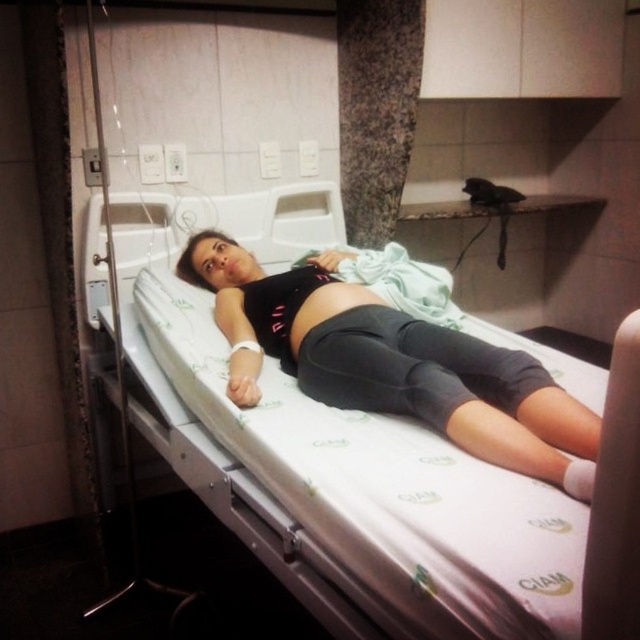
You are a nurse in the hospital room and need to locate two specific points for medical procedures. The first point is at coordinate point (387, 513) and the second is at point (189, 276). Which point is closer to you?

Point (387, 513) is closer to the viewer than point (189, 276).

You are a nurse checking the patient in the hospital room. You need to adjust the bed height to ensure the patient can safely sit up. Considering the current height of the white fabric hospital bed at center and the height of the black matte leggings at center, what should you do?

The white fabric hospital bed at center is taller than the black matte leggings at center. To allow the patient to sit up safely, adjust the bed height so that the mattress surface is at a comfortable level where the patient can easily place their feet on the floor while sitting, ensuring they can support themselves without straining.

In the scene shown: You are a healthcare worker entering the room and need to approach the white fabric hospital bed at center to check the patient. Considering the distance from the camera to the bed is 26.24 inches, can you estimate how many steps you need to take to reach the bed if each step covers approximately 2 feet?

The distance from the camera to the white fabric hospital bed at center is 26.24 inches. Since each step covers about 24 inches, you would need approximately 1 step to reach the bed, as 26.24 inches is slightly more than 2 feet but within a single step range.